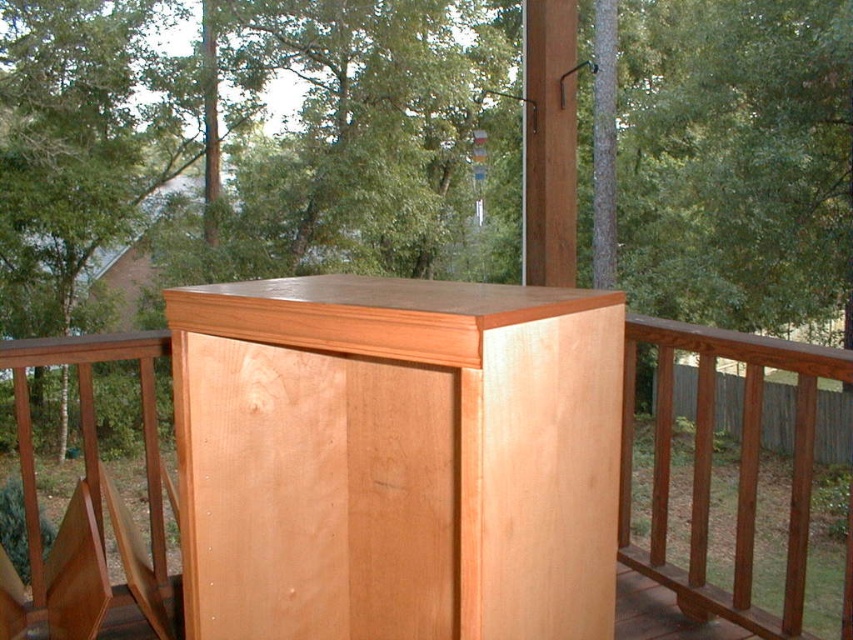
You are standing on the deck and want to place a tall potted plant between the natural wood tree at center and the natural wood cabinet at center. Which object should the plant be placed closer to to ensure it doesn not block the view of the shorter object?

The natural wood cabinet at center is shorter than the natural wood tree at center. To avoid blocking the view of the shorter object, the tall potted plant should be placed closer to the natural wood tree at center.

You are standing on the deck and see the natural wood tree at center and the natural wood cabinet at center. Which object is located above the other?

The natural wood tree at center is positioned over the natural wood cabinet at center, so the tree is above the cabinet.